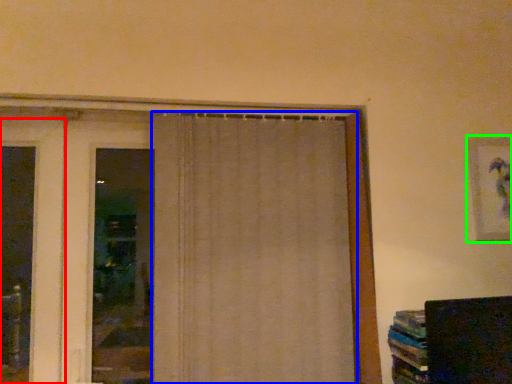
Question: Which object is the farthest from door (highlighted by a red box)? Choose among these: curtain (highlighted by a blue box) or picture frame (highlighted by a green box).

Choices:
 (A) curtain
 (B) picture frame

Answer: (B)